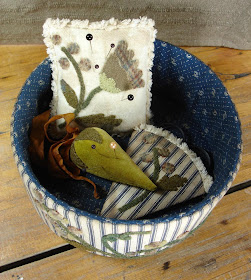
Find the location of a particular element. Image resolution: width=251 pixels, height=280 pixels. basket is located at coordinates (229, 147).